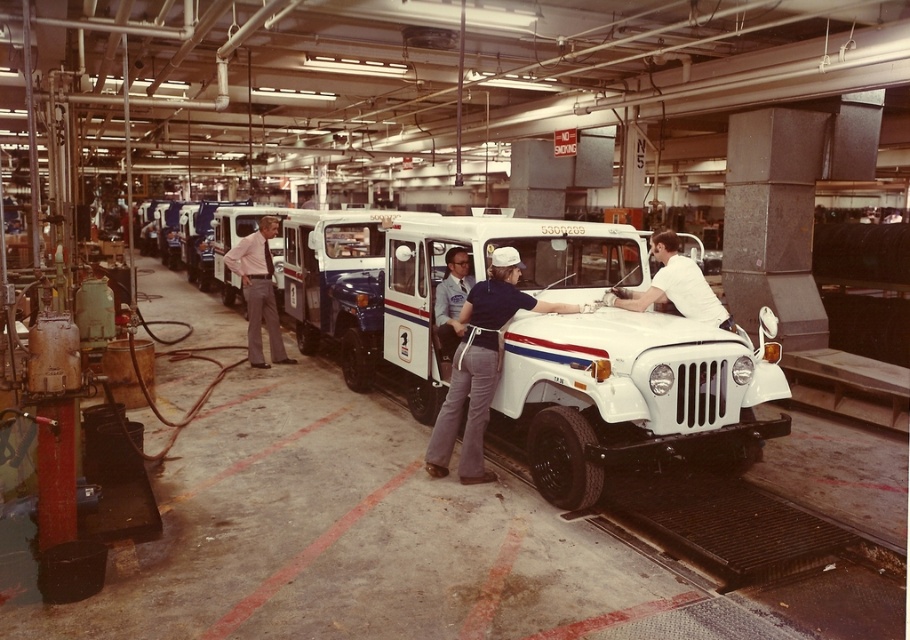
Question: Which of the following is the closest to the observer?

Choices:
 (A) (450, 378)
 (B) (239, 273)

Answer: (A)

Question: Does denim pants at center have a lesser width compared to light pink shirt at center?

Choices:
 (A) yes
 (B) no

Answer: (B)

Question: Which point is farther to the camera?

Choices:
 (A) denim pants at center
 (B) light pink shirt at center

Answer: (B)

Question: Is denim pants at center positioned in front of light pink shirt at center?

Choices:
 (A) no
 (B) yes

Answer: (B)

Question: Observing the image, what is the correct spatial positioning of denim pants at center in reference to light pink shirt at center?

Choices:
 (A) below
 (B) above

Answer: (A)